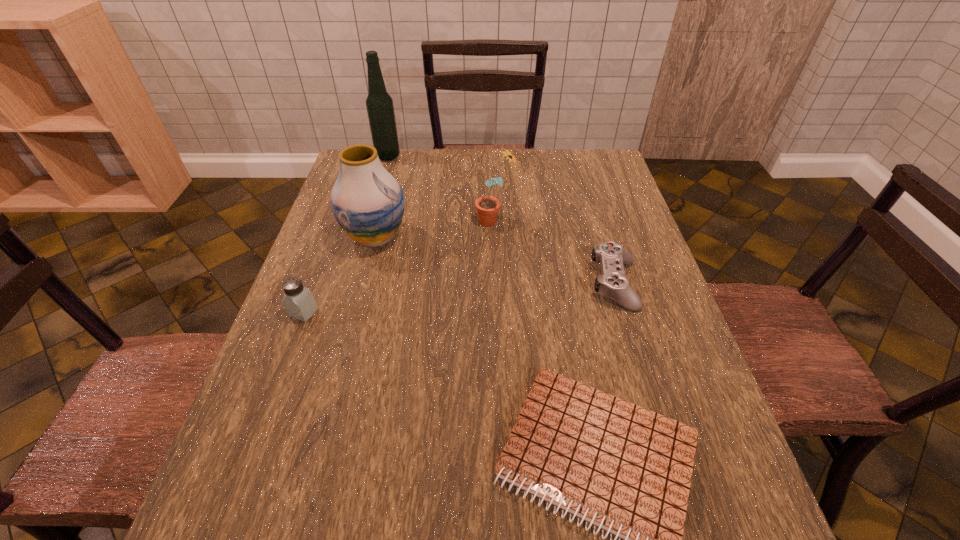
At what (x,y) coordinates should I click in order to perform the action: click on the farthest object. Please return your answer as a coordinate pair (x, y). Image resolution: width=960 pixels, height=540 pixels. Looking at the image, I should click on (379, 104).

Where is `the tallest object`? The image size is (960, 540). the tallest object is located at coordinates (379, 104).

This screenshot has height=540, width=960. In order to click on vase in this screenshot , I will do `click(367, 202)`.

The image size is (960, 540). What are the coordinates of `sunflower` in the screenshot? It's located at (487, 206).

Identify the location of saltshaker. (299, 302).

The height and width of the screenshot is (540, 960). What are the coordinates of `the fifth tallest object` in the screenshot? It's located at (613, 284).

Locate an element on the screen. The image size is (960, 540). vacant space located on the right of the alcohol is located at coordinates (507, 157).

The height and width of the screenshot is (540, 960). What are the coordinates of `free space located 0.140m on the right of the vase` in the screenshot? It's located at (460, 237).

Identify the location of free space located 0.160m on the flower of the sunflower. This screenshot has width=960, height=540. (420, 220).

You are a GUI agent. You are given a task and a screenshot of the screen. Output one action in this format:
    pyautogui.click(x=<x>, y=<y>)
    Task: Click on the vacant space located 0.070m on the flower of the sunflower
    This screenshot has height=540, width=960.
    Given the screenshot: What is the action you would take?
    pyautogui.click(x=451, y=220)